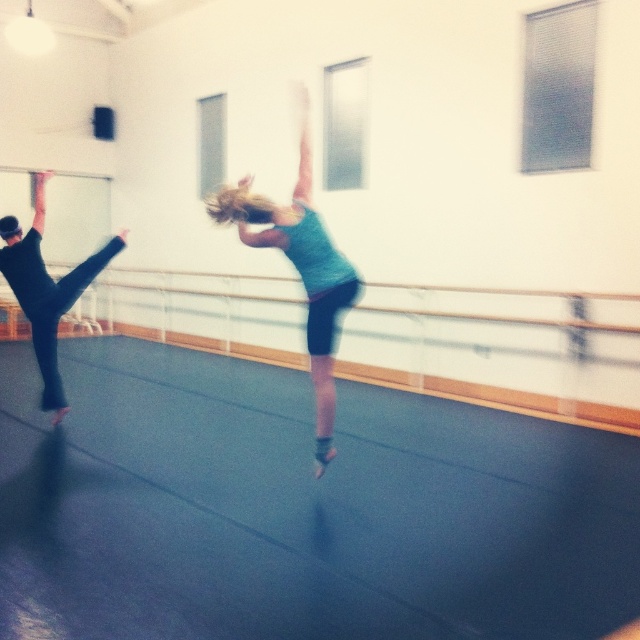
You are a photographer setting up a shoot in the dance studio. You want to ensure both the teal fabric ballerina at center and the black matte leggings at left are clearly visible in your photo. Given their sizes, which one might require more careful framing to avoid being too small in the shot?

The black matte leggings at left is smaller than the teal fabric ballerina at center, so it might require more careful framing to avoid being too small in the shot.

In the scene shown: You are standing in the dance studio and want to place a teal fabric ballerina at center. Where should you position it to match the image?

The teal fabric ballerina at center should be positioned at coordinates point (300, 269) to match the image.

You are standing at the camera position and want to take a photo of the teal fabric ballerina at center. If your camera has a maximum focus range of 4 meters, will you be able to focus on the ballerina?

The teal fabric ballerina at center and camera are 4.14 meters apart. Since the distance exceeds the camera maximum focus range of 4 meters, the camera cannot focus on the ballerina.